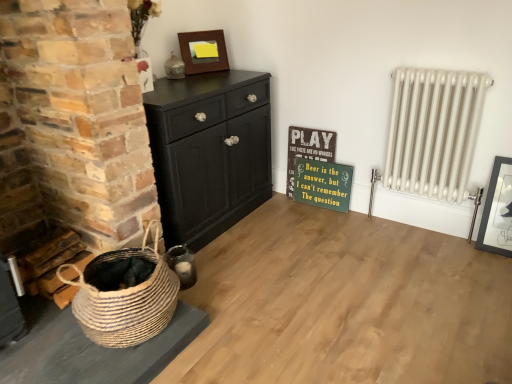
Where is `free spot to the right of black painted wood chest of drawers at left`? The width and height of the screenshot is (512, 384). free spot to the right of black painted wood chest of drawers at left is located at coordinates (305, 229).